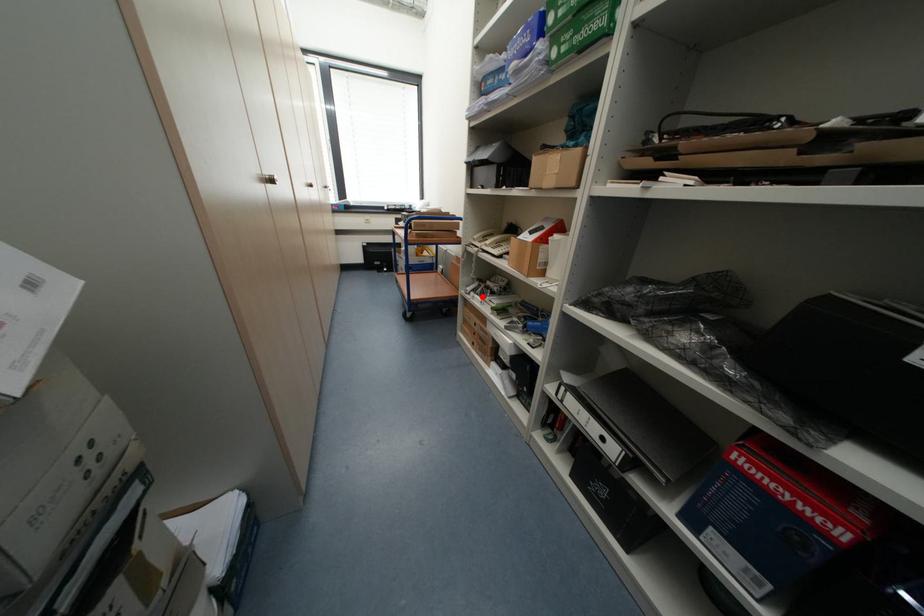
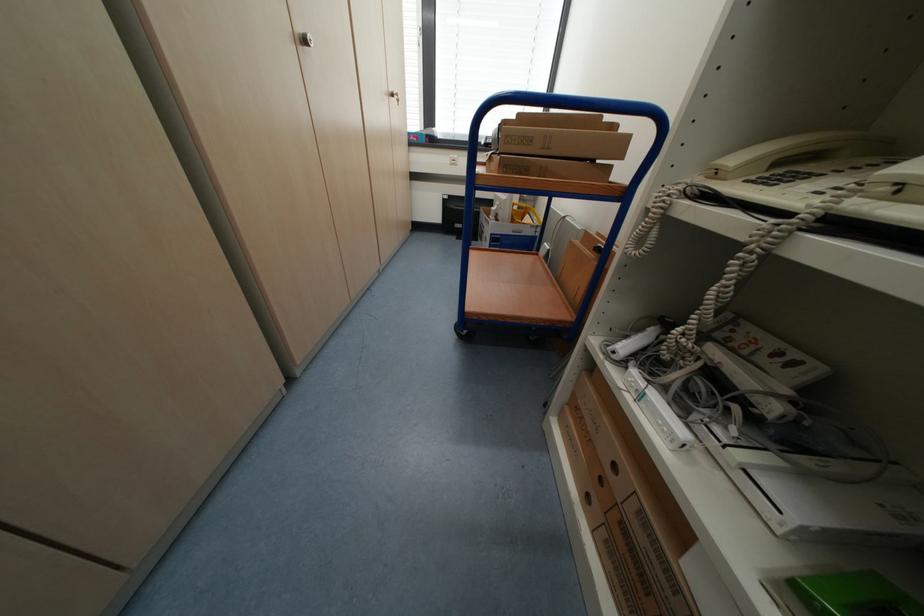
Find the pixel in the second image that matches the highlighted location in the first image.

(662, 398)